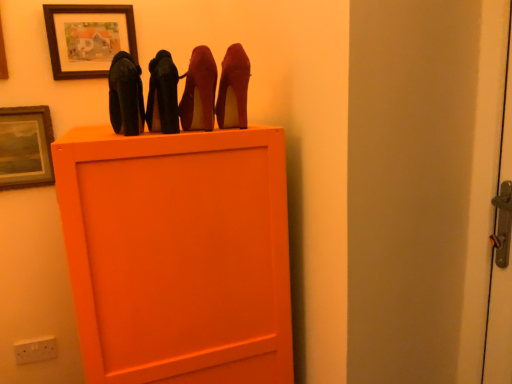
Question: Choose the correct answer: Is suede-like red high heels at upper center, acting as the fourth high heels starting from the left, inside matte wooden picture frame at upper center, which is counted as the 2th picture frame, starting from the left, or outside it?

Choices:
 (A) inside
 (B) outside

Answer: (B)

Question: Considering the positions of suede-like red high heels at upper center, which appears as the first high heels when viewed from the right, and matte wooden picture frame at upper center, the 1th picture frame in the right-to-left sequence, in the image, is suede-like red high heels at upper center, which appears as the first high heels when viewed from the right, wider or thinner than matte wooden picture frame at upper center, the 1th picture frame in the right-to-left sequence,?

Choices:
 (A) thin
 (B) wide

Answer: (B)

Question: Based on their relative distances, which object is nearer to the suede-like red high heels at upper center, acting as the fourth high heels starting from the left?

Choices:
 (A) matte black high heels at upper center, the 1th high heels viewed from the left
 (B) shiny red high heels at upper center, the second high heels in the right-to-left sequence
 (C) white plastic electric outlet at lower left
 (D) shiny black high heels at center, the second high heels positioned from the left
 (E) wooden picture frame at upper left, the 1th picture frame in the bottom-to-top sequence

Answer: (B)

Question: Considering the real-world distances, which object is closest to the shiny red high heels at upper center, acting as the 3th high heels starting from the left?

Choices:
 (A) suede-like red high heels at upper center, acting as the fourth high heels starting from the left
 (B) matte black high heels at upper center, the fourth high heels when ordered from right to left
 (C) wooden picture frame at upper left, which is the second picture frame from right to left
 (D) shiny black high heels at center, the second high heels positioned from the left
 (E) matte wooden picture frame at upper center, which is counted as the 2th picture frame, starting from the left

Answer: (A)